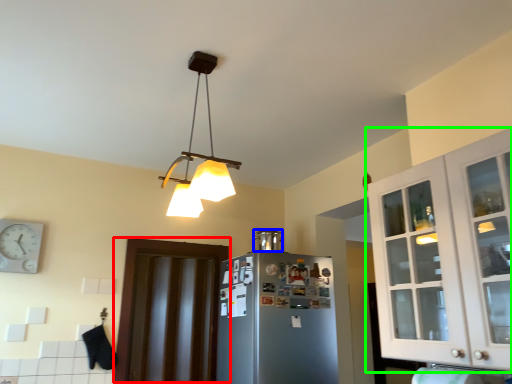
Question: Estimate the real-world distances between objects in this image. Which object is farther from door (highlighted by a red box), appliance (highlighted by a blue box) or cabinetry (highlighted by a green box)?

Choices:
 (A) appliance
 (B) cabinetry

Answer: (B)